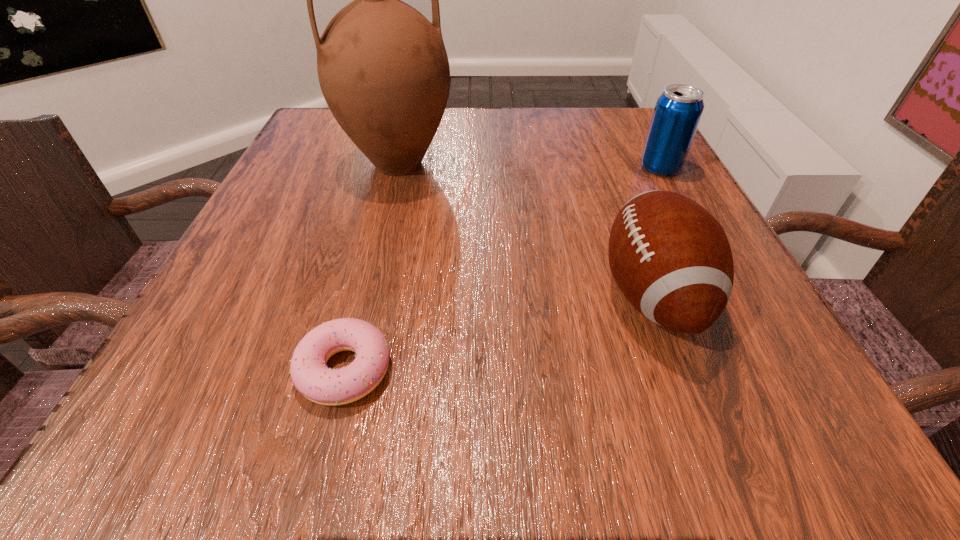
The image size is (960, 540). Find the location of `blank region between the pop soda and the shortest object`. blank region between the pop soda and the shortest object is located at coordinates (503, 268).

The image size is (960, 540). In order to click on object that is the third closest one to the football in this screenshot , I will do click(x=310, y=375).

Find the location of a particular element. This screenshot has width=960, height=540. object that stands as the second closest to the football is located at coordinates (383, 69).

Locate an element on the screen. The width and height of the screenshot is (960, 540). free location that satisfies the following two spatial constraints: 1. on the back side of the pop soda; 2. on the right side of the doughnut is located at coordinates (396, 167).

Identify the location of vacant space that satisfies the following two spatial constraints: 1. on the back side of the shortest object; 2. on the left side of the tallest object. (396, 164).